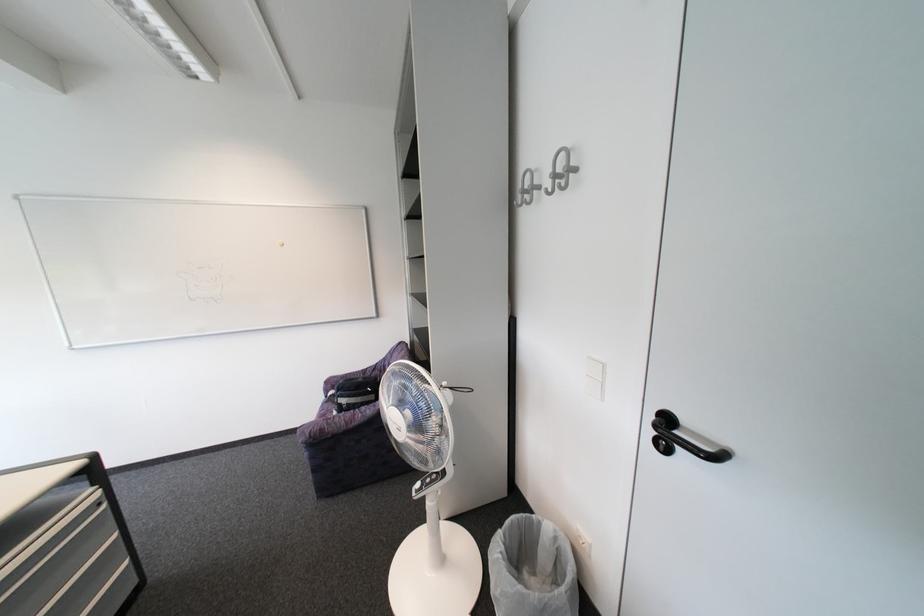
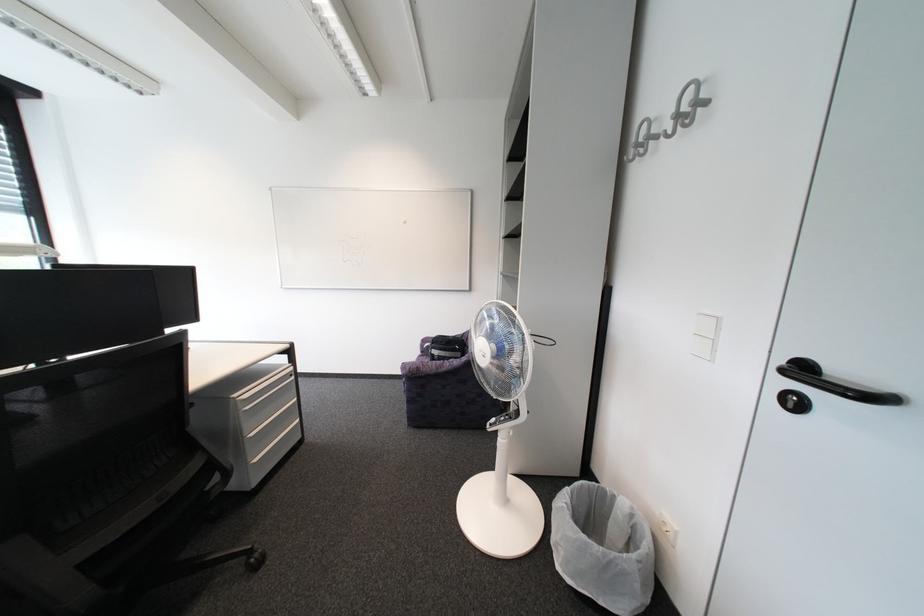
Question: The images are taken continuously from a first-person perspective. In which direction are you moving?

Choices:
 (A) Left
 (B) Right
 (C) Forward
 (D) Backward

Answer: (D)